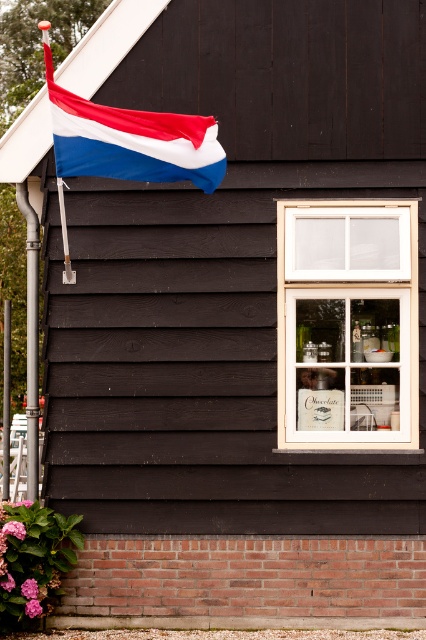
Can you confirm if white wooden window at center is positioned below matte fabric flag at upper left?

Yes, white wooden window at center is below matte fabric flag at upper left.

Who is more forward, (339, 349) or (51, 120)?

Point (51, 120) is more forward.

Identify the location of white wooden window at center. (348, 324).